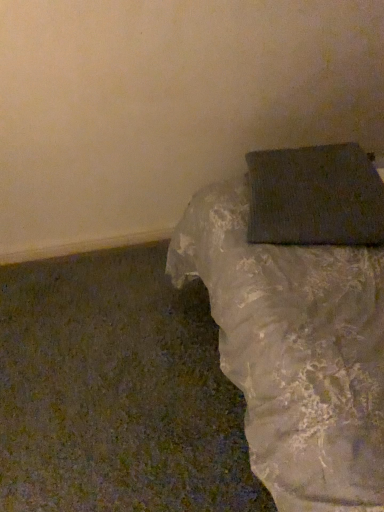
What do you see at coordinates (315, 196) in the screenshot?
I see `matte gray wrapping paper at lower right` at bounding box center [315, 196].

In order to click on matte gray wrapping paper at lower right in this screenshot , I will do `click(315, 196)`.

Looking at this image, what is the approximate height of matte gray box at upper right?

It is 1.24 meters.

Describe the element at coordinates (294, 351) in the screenshot. The height and width of the screenshot is (512, 384). I see `matte gray box at upper right` at that location.

Where is `matte gray box at upper right`? matte gray box at upper right is located at coordinates (294, 351).

Locate an element on the screen. matte gray wrapping paper at lower right is located at coordinates (315, 196).

Based on the photo, considering the relative positions of matte gray box at upper right and matte gray wrapping paper at lower right in the image provided, is matte gray box at upper right to the left or to the right of matte gray wrapping paper at lower right?

In the image, matte gray box at upper right appears on the right side of matte gray wrapping paper at lower right.

Does matte gray box at upper right come in front of matte gray wrapping paper at lower right?

Yes, it is.

Considering the points (301, 458) and (275, 164), which point is behind, point (301, 458) or point (275, 164)?

Point (275, 164)

From the image's perspective, between matte gray box at upper right and matte gray wrapping paper at lower right, which one is located above?

From the image's view, matte gray wrapping paper at lower right is above.

From a real-world perspective, is matte gray box at upper right physically above matte gray wrapping paper at lower right?

No, from a real-world perspective, matte gray box at upper right is not above matte gray wrapping paper at lower right.

Does matte gray box at upper right have a lesser width compared to matte gray wrapping paper at lower right?

In fact, matte gray box at upper right might be wider than matte gray wrapping paper at lower right.

Can you confirm if matte gray box at upper right is taller than matte gray wrapping paper at lower right?

Yes, matte gray box at upper right is taller than matte gray wrapping paper at lower right.

Which of these two, matte gray box at upper right or matte gray wrapping paper at lower right, is smaller?

matte gray wrapping paper at lower right.

Could matte gray wrapping paper at lower right be considered to be inside matte gray box at upper right?

Yes.

Is matte gray box at upper right touching matte gray wrapping paper at lower right?

No, matte gray box at upper right is not with matte gray wrapping paper at lower right.

Is matte gray box at upper right turned away from matte gray wrapping paper at lower right?

Yes, matte gray wrapping paper at lower right is at the back of matte gray box at upper right.

How different are the orientations of matte gray box at upper right and matte gray wrapping paper at lower right in degrees?

17.1 degrees separate the facing orientations of matte gray box at upper right and matte gray wrapping paper at lower right.

Measure the distance from matte gray box at upper right to matte gray wrapping paper at lower right.

4.43 inches.

In the image, there is a matte gray box at upper right. Where is `wrapping paper above it (from the image's perspective)`? The height and width of the screenshot is (512, 384). wrapping paper above it (from the image's perspective) is located at coordinates (315, 196).

Would you say matte gray wrapping paper at lower right is to the left or to the right of matte gray box at upper right in the picture?

Based on their positions, matte gray wrapping paper at lower right is located to the left of matte gray box at upper right.

Is matte gray wrapping paper at lower right positioned behind matte gray box at upper right?

Yes, the depth of matte gray wrapping paper at lower right is greater than that of matte gray box at upper right.

Considering the positions of point (283, 197) and point (324, 226), is point (283, 197) closer or farther from the camera than point (324, 226)?

Point (283, 197) appears to be farther away from the viewer than point (324, 226).

From the image's perspective, is matte gray wrapping paper at lower right positioned above or below matte gray box at upper right?

matte gray wrapping paper at lower right is above matte gray box at upper right.

From a real-world perspective, is matte gray wrapping paper at lower right under matte gray box at upper right?

Incorrect, from a real-world perspective, matte gray wrapping paper at lower right is higher than matte gray box at upper right.

Looking at their sizes, would you say matte gray wrapping paper at lower right is wider or thinner than matte gray box at upper right?

matte gray wrapping paper at lower right is thinner than matte gray box at upper right.

Between matte gray wrapping paper at lower right and matte gray box at upper right, which one has less height?

With less height is matte gray wrapping paper at lower right.

From the picture: In terms of size, does matte gray wrapping paper at lower right appear bigger or smaller than matte gray box at upper right?

Considering their sizes, matte gray wrapping paper at lower right takes up less space than matte gray box at upper right.

Is matte gray wrapping paper at lower right situated inside matte gray box at upper right or outside?

matte gray wrapping paper at lower right is contained in matte gray box at upper right.

Is matte gray wrapping paper at lower right next to matte gray box at upper right?

No, matte gray wrapping paper at lower right is not beside matte gray box at upper right.

Is matte gray wrapping paper at lower right facing away from matte gray box at upper right?

Yes.

Can you tell me how much matte gray wrapping paper at lower right and matte gray box at upper right differ in facing direction?

matte gray wrapping paper at lower right and matte gray box at upper right are facing 17.1 degrees away from each other.

How much distance is there between matte gray wrapping paper at lower right and matte gray box at upper right?

A distance of 4.43 inches exists between matte gray wrapping paper at lower right and matte gray box at upper right.

Identify the location of wrapping paper above the matte gray box at upper right (from a real-world perspective). The width and height of the screenshot is (384, 512). (315, 196).

You are a GUI agent. You are given a task and a screenshot of the screen. Output one action in this format:
    pyautogui.click(x=<x>, y=<y>)
    Task: Click on the wrapping paper above the matte gray box at upper right (from a real-world perspective)
    Image resolution: width=384 pixels, height=512 pixels.
    Given the screenshot: What is the action you would take?
    pyautogui.click(x=315, y=196)

What are the coordinates of `furniture that is on the right side of matte gray wrapping paper at lower right` in the screenshot? It's located at (294, 351).